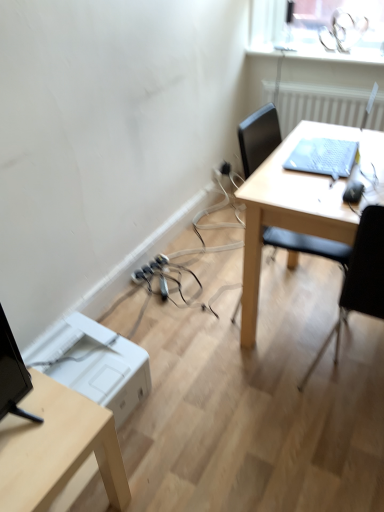
Question: In terms of size, does white plastic printer at lower left appear bigger or smaller than black plastic chair at right?

Choices:
 (A) big
 (B) small

Answer: (B)

Question: Visually, is white plastic printer at lower left positioned to the left or to the right of black plastic chair at right?

Choices:
 (A) right
 (B) left

Answer: (B)

Question: Considering the real-world distances, which object is closest to the light wood table at center?

Choices:
 (A) light wood desk at lower left
 (B) black plastic extension cord at lower center
 (C) white textured radiator at upper right
 (D) black plastic chair at right
 (E) white plastic printer at lower left

Answer: (D)

Question: Which object is the closest to the white textured radiator at upper right?

Choices:
 (A) white plastic printer at lower left
 (B) black plastic extension cord at lower center
 (C) black plastic chair at right
 (D) light wood table at center
 (E) light wood desk at lower left

Answer: (D)